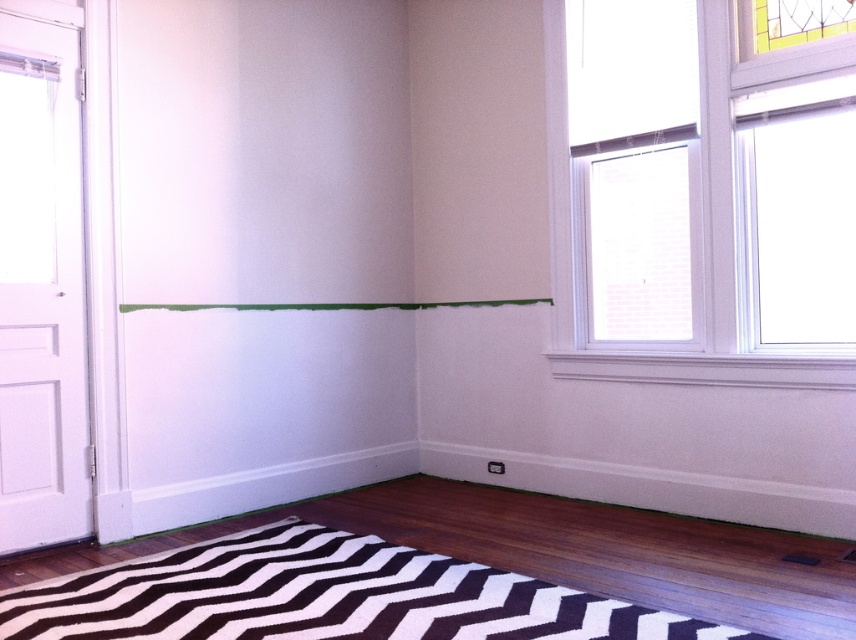
Question: Which of the following is the farthest from the observer?

Choices:
 (A) (551, 588)
 (B) (726, 381)

Answer: (B)

Question: Which point appears closest to the camera in this image?

Choices:
 (A) (556, 17)
 (B) (167, 570)

Answer: (B)

Question: Is black and white zigzag rug at lower center further to camera compared to white glass window at upper right?

Choices:
 (A) no
 (B) yes

Answer: (A)

Question: Among these objects, which one is farthest from the camera?

Choices:
 (A) white glass window at upper right
 (B) black and white zigzag rug at lower center

Answer: (A)

Question: Is black and white zigzag rug at lower center bigger than white glass window at upper right?

Choices:
 (A) yes
 (B) no

Answer: (B)

Question: Can you confirm if black and white zigzag rug at lower center is thinner than white glass window at upper right?

Choices:
 (A) yes
 (B) no

Answer: (B)